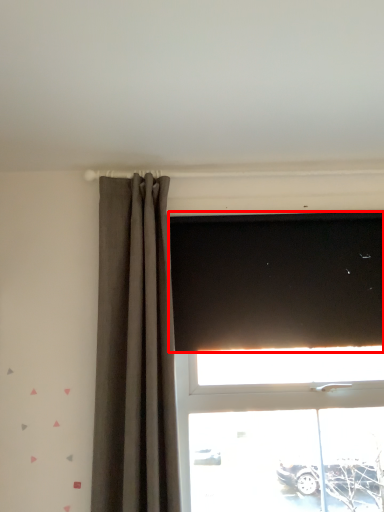
Question: From the image's perspective, considering the relative positions of blind (annotated by the red box) and curtain in the image provided, where is blind (annotated by the red box) located with respect to the staircase?

Choices:
 (A) above
 (B) below

Answer: (A)